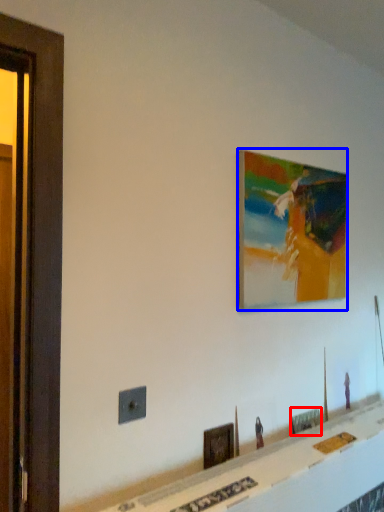
Question: Which object is further to the camera taking this photo, picture frame (highlighted by a red box) or picture frame (highlighted by a blue box)?

Choices:
 (A) picture frame
 (B) picture frame

Answer: (A)